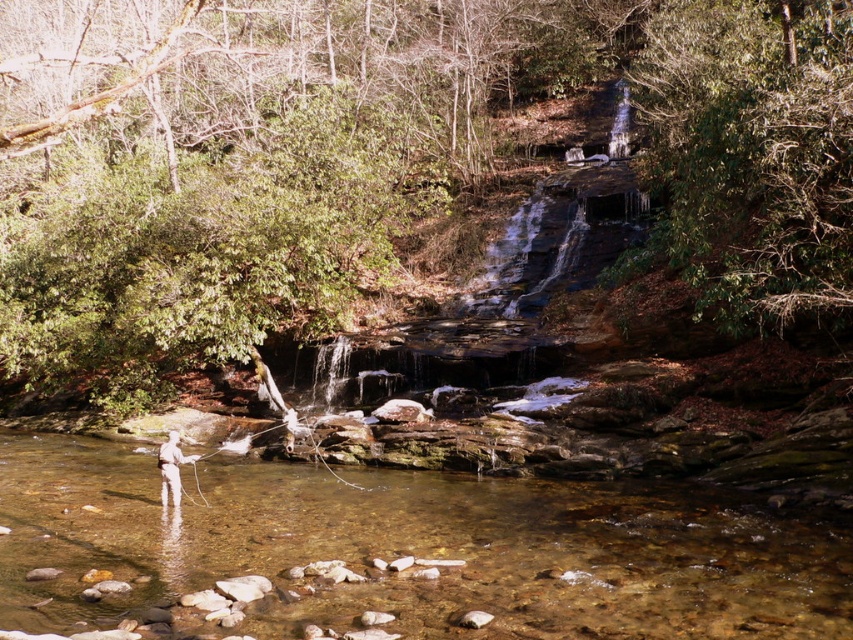
Question: Can you confirm if clear water at center is positioned below green leafy tree at upper right?

Choices:
 (A) no
 (B) yes

Answer: (B)

Question: Is green leafy tree at center positioned in front of green leafy tree at upper right?

Choices:
 (A) no
 (B) yes

Answer: (B)

Question: Which object appears closest to the camera in this image?

Choices:
 (A) green leafy tree at center
 (B) clear water at center
 (C) green leafy tree at upper right

Answer: (A)

Question: Based on their relative distances, which object is farther from the clear water at center?

Choices:
 (A) green leafy tree at upper right
 (B) green leafy tree at center

Answer: (B)

Question: Which of the following is the farthest from the observer?

Choices:
 (A) pos(421,99)
 (B) pos(660,634)
 (C) pos(701,280)

Answer: (A)

Question: Does green leafy tree at center have a greater width compared to clear water at center?

Choices:
 (A) yes
 (B) no

Answer: (A)